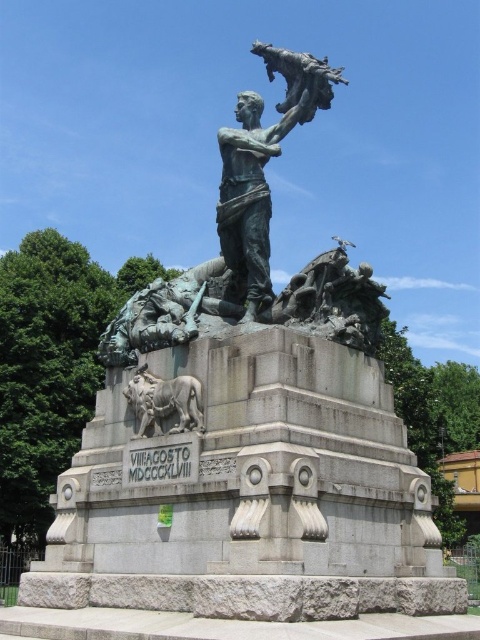
Can you confirm if bronze statue at center is positioned below sculpted stone lion at lower left?

No, bronze statue at center is not below sculpted stone lion at lower left.

This screenshot has height=640, width=480. Describe the element at coordinates (250, 196) in the screenshot. I see `bronze statue at center` at that location.

At what (x,y) coordinates should I click in order to perform the action: click on bronze statue at center. Please return your answer as a coordinate pair (x, y). The width and height of the screenshot is (480, 640). Looking at the image, I should click on (250, 196).